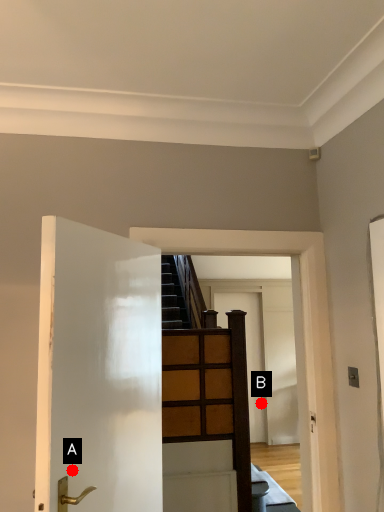
Question: Two points are circled on the image, labeled by A and B beside each circle. Which point is closer to the camera?

Choices:
 (A) A is closer
 (B) B is closer

Answer: (A)